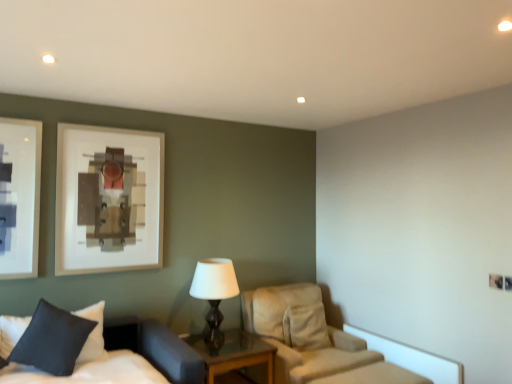
What is the approximate height of beige fabric chair at center?

The height of beige fabric chair at center is 34.12 inches.

Identify the location of wooden glass top nightstand at center. This screenshot has height=384, width=512. (234, 353).

Describe the element at coordinates (123, 364) in the screenshot. I see `white soft bed at lower left` at that location.

Locate an element on the screen. The width and height of the screenshot is (512, 384). matte black table lamp at center is located at coordinates (214, 294).

Based on the photo, is dark blue fabric pillow at lower left facing towards wooden glass top nightstand at center?

No.

Considering the positions of point (67, 333) and point (250, 356), is point (67, 333) closer or farther from the camera than point (250, 356)?

Point (67, 333).

Is the depth of dark blue fabric pillow at lower left greater than that of wooden glass top nightstand at center?

No, dark blue fabric pillow at lower left is closer to the camera.

From a real-world perspective, is dark blue fabric pillow at lower left positioned over wooden glass top nightstand at center based on gravity?

Yes, from a real-world perspective, dark blue fabric pillow at lower left is on top of wooden glass top nightstand at center.

Which is more to the right, wooden glass top nightstand at center or dark blue fabric pillow at lower left?

Positioned to the right is wooden glass top nightstand at center.

Is wooden glass top nightstand at center wider than dark blue fabric pillow at lower left?

Indeed, wooden glass top nightstand at center has a greater width compared to dark blue fabric pillow at lower left.

Considering the relative positions of wooden glass top nightstand at center and dark blue fabric pillow at lower left in the image provided, is wooden glass top nightstand at center in front of dark blue fabric pillow at lower left?

No, it is behind dark blue fabric pillow at lower left.

Looking at the image, does matte black table lamp at center seem bigger or smaller compared to wooden glass top nightstand at center?

Considering their sizes, matte black table lamp at center takes up less space than wooden glass top nightstand at center.

Can you confirm if matte black table lamp at center is thinner than wooden glass top nightstand at center?

Indeed, matte black table lamp at center has a lesser width compared to wooden glass top nightstand at center.

From a real-world perspective, who is located lower, matte black table lamp at center or wooden glass top nightstand at center?

wooden glass top nightstand at center.

Which object is positioned more to the right, matte black table lamp at center or wooden glass top nightstand at center?

wooden glass top nightstand at center is more to the right.

In the scene shown: Would you say beige fabric chair at center is outside matte black table lamp at center?

Yes.

Can you confirm if beige fabric chair at center is positioned to the left of matte black table lamp at center?

No, beige fabric chair at center is not to the left of matte black table lamp at center.

From a real-world perspective, is beige fabric chair at center under matte black table lamp at center?

Yes, from a real-world perspective, beige fabric chair at center is beneath matte black table lamp at center.

Which of these two, beige fabric chair at center or matte black table lamp at center, stands taller?

With more height is beige fabric chair at center.

Is white soft bed at lower left turned away from matte black table lamp at center?

white soft bed at lower left does not have its back to matte black table lamp at center.

Which object is further away from the camera, white soft bed at lower left or matte black table lamp at center?

matte black table lamp at center is further from the camera.

From a real-world perspective, is white soft bed at lower left under matte black table lamp at center?

Yes, from a real-world perspective, white soft bed at lower left is below matte black table lamp at center.

Does matte black table lamp at center have a larger size compared to dark blue fabric pillow at lower left?

Yes.

Does matte black table lamp at center come in front of dark blue fabric pillow at lower left?

No, it is behind dark blue fabric pillow at lower left.

Consider the image. From a real-world perspective, between matte black table lamp at center and dark blue fabric pillow at lower left, who is vertically higher?

matte black table lamp at center, from a real-world perspective.

Does point (196, 269) come in front of point (75, 315)?

No, (196, 269) is behind (75, 315).

From the image's perspective, between matte black table lamp at center and beige fabric chair at center, who is located below?

From the image's view, beige fabric chair at center is below.

This screenshot has height=384, width=512. I want to click on table lamp behind the beige fabric chair at center, so click(214, 294).

Considering the relative positions of matte black table lamp at center and beige fabric chair at center in the image provided, is matte black table lamp at center in front of beige fabric chair at center?

No, it is behind beige fabric chair at center.

Which is behind, point (204, 261) or point (325, 352)?

The point (204, 261) is farther.

In the image, there is a dark blue fabric pillow at lower left. Where is `nightstand below it (from a real-world perspective)`? The height and width of the screenshot is (384, 512). nightstand below it (from a real-world perspective) is located at coordinates (234, 353).

Identify the location of nightstand lying below the dark blue fabric pillow at lower left (from the image's perspective). Image resolution: width=512 pixels, height=384 pixels. click(234, 353).

From the image, which object appears to be farther from wooden glass top nightstand at center, white soft bed at lower left or dark blue fabric pillow at lower left?

Among the two, dark blue fabric pillow at lower left is located further to wooden glass top nightstand at center.

Estimate the real-world distances between objects in this image. Which object is closer to matte black table lamp at center, dark blue fabric pillow at lower left or wooden glass top nightstand at center?

Based on the image, wooden glass top nightstand at center appears to be nearer to matte black table lamp at center.

From the image, which object appears to be nearer to matte black table lamp at center, beige fabric chair at center or wooden glass top nightstand at center?

wooden glass top nightstand at center is closer to matte black table lamp at center.

Looking at the image, which one is located further to wooden glass top nightstand at center, white soft bed at lower left or beige fabric chair at center?

Based on the image, white soft bed at lower left appears to be further to wooden glass top nightstand at center.

Based on their spatial positions, is beige fabric chair at center or matte black table lamp at center further from white soft bed at lower left?

beige fabric chair at center lies further to white soft bed at lower left than the other object.

Which object lies further to the anchor point wooden glass top nightstand at center, dark blue fabric pillow at lower left or matte black table lamp at center?

The object further to wooden glass top nightstand at center is dark blue fabric pillow at lower left.

Looking at the image, which one is located further to wooden glass top nightstand at center, matte black table lamp at center or beige fabric chair at center?

beige fabric chair at center is positioned further to the anchor wooden glass top nightstand at center.

When comparing their distances from beige fabric chair at center, does dark blue fabric pillow at lower left or matte black table lamp at center seem further?

dark blue fabric pillow at lower left is further to beige fabric chair at center.

Where is `nightstand between white soft bed at lower left and beige fabric chair at center along the z-axis`? The image size is (512, 384). nightstand between white soft bed at lower left and beige fabric chair at center along the z-axis is located at coordinates (234, 353).

Identify the location of table lamp located between dark blue fabric pillow at lower left and beige fabric chair at center in the left-right direction. (214, 294).

Identify the location of bed located between dark blue fabric pillow at lower left and beige fabric chair at center in the left-right direction. This screenshot has width=512, height=384. (123, 364).

Locate an element on the screen. This screenshot has width=512, height=384. chair between white soft bed at lower left and matte black table lamp at center from front to back is located at coordinates (314, 340).